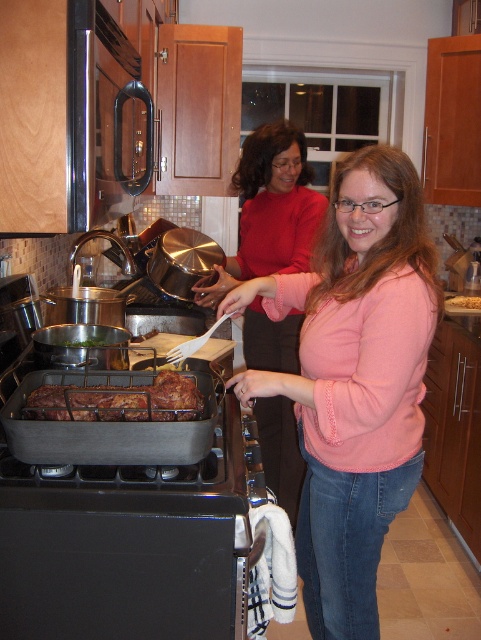
Does pink matte sweater at center come behind golden brown bread at center?

No, it is not.

Which is in front, point (350, 552) or point (472, 301)?

Positioned in front is point (350, 552).

Find the location of a particular element. pink matte sweater at center is located at coordinates (354, 380).

The image size is (481, 640). In order to click on pink matte sweater at center in this screenshot , I will do `click(354, 380)`.

Is pink matte sweater at center to the right of pink sweater at center from the viewer's perspective?

Correct, you'll find pink matte sweater at center to the right of pink sweater at center.

Does pink matte sweater at center have a lesser height compared to pink sweater at center?

Yes.

Locate an element on the screen. The width and height of the screenshot is (481, 640). pink matte sweater at center is located at coordinates (354, 380).

This screenshot has width=481, height=640. I want to click on pink matte sweater at center, so click(354, 380).

Does brown crispy meat at center appear over golden brown bread at center?

Actually, brown crispy meat at center is below golden brown bread at center.

Can you confirm if brown crispy meat at center is smaller than golden brown bread at center?

No, brown crispy meat at center is not smaller than golden brown bread at center.

Who is more distant from viewer, (77, 408) or (480, 301)?

The point (480, 301) is more distant.

Locate an element on the screen. This screenshot has height=640, width=481. brown crispy meat at center is located at coordinates (118, 401).